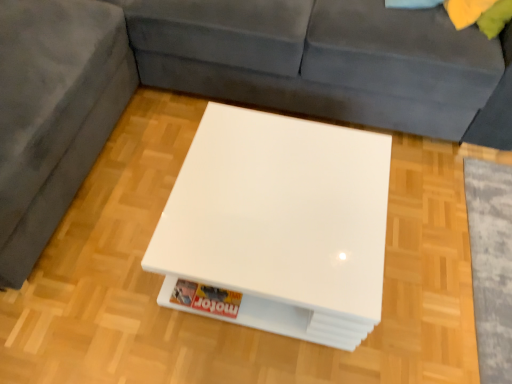
Locate an element on the screen. The width and height of the screenshot is (512, 384). free spot above white glossy table at center (from a real-world perspective) is located at coordinates (247, 215).